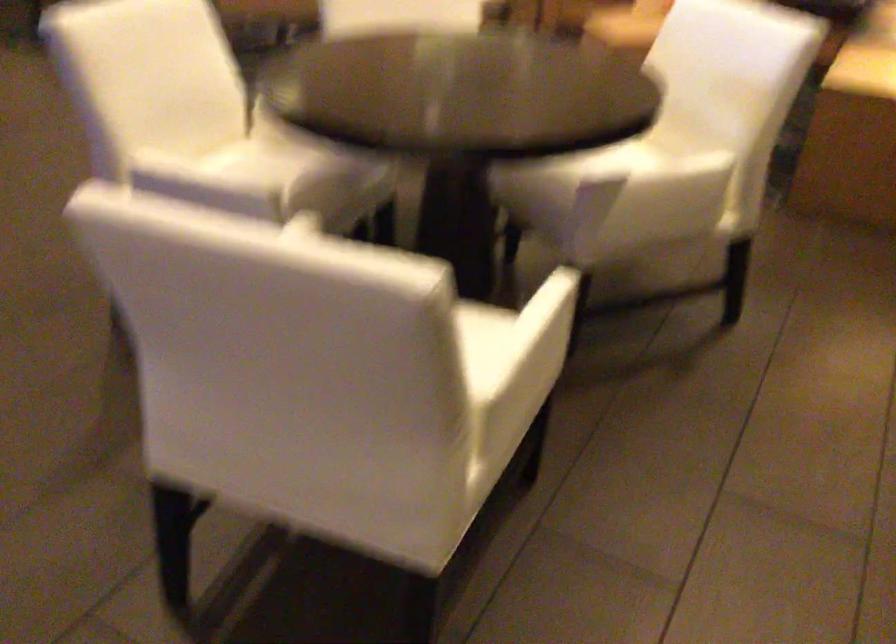
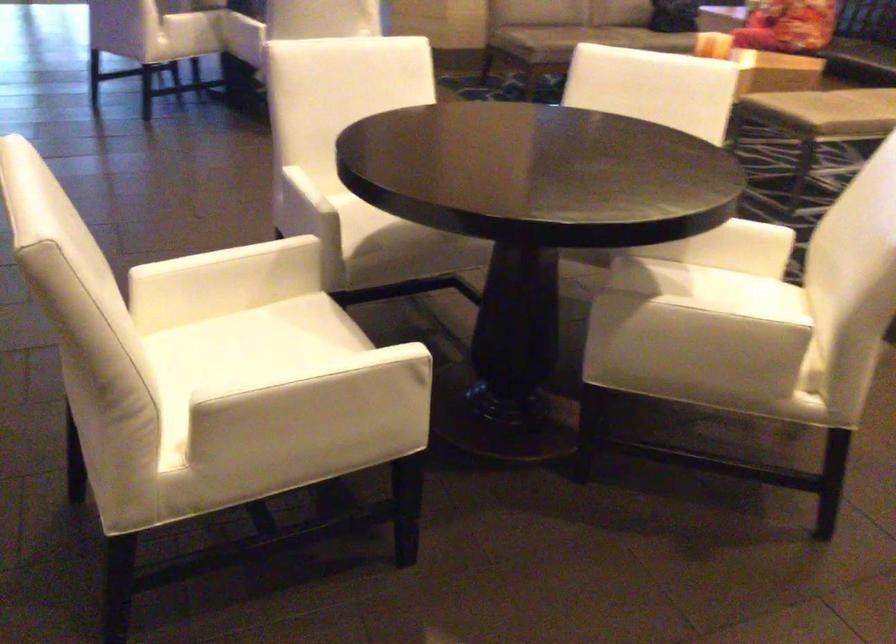
Locate, in the second image, the point that corresponds to the point at 272,194 in the first image.

(372, 223)